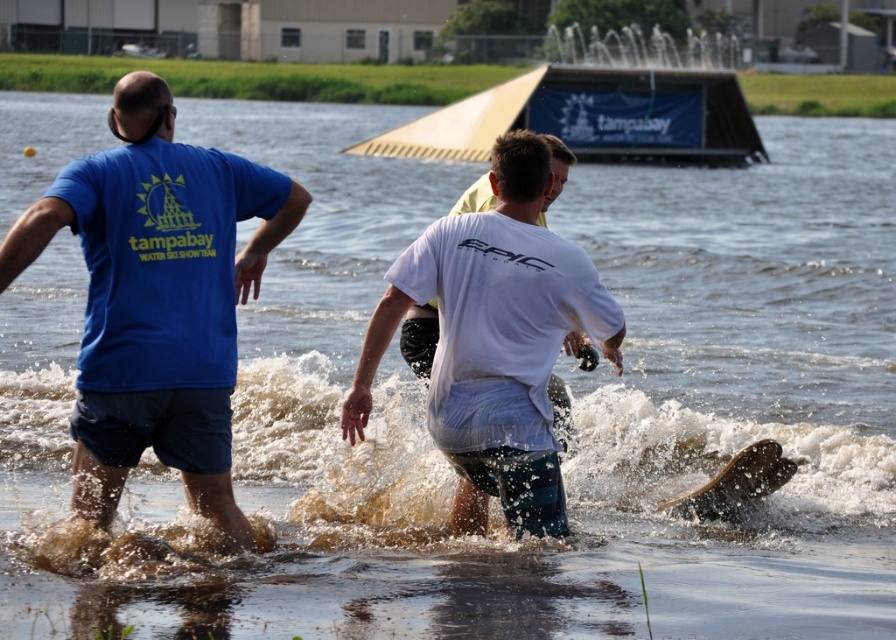
Question: Among these points, which one is farthest from the camera?

Choices:
 (A) (237, 220)
 (B) (459, 284)

Answer: (A)

Question: Does blue cotton t-shirt at upper left appear on the right side of white cotton shirt at center?

Choices:
 (A) yes
 (B) no

Answer: (B)

Question: In this image, where is blue cotton t-shirt at upper left located relative to white cotton shirt at center?

Choices:
 (A) above
 (B) below

Answer: (A)

Question: Among these objects, which one is nearest to the camera?

Choices:
 (A) white cotton shirt at center
 (B) blue cotton t-shirt at upper left

Answer: (B)

Question: Can you confirm if blue cotton t-shirt at upper left is smaller than white cotton shirt at center?

Choices:
 (A) yes
 (B) no

Answer: (B)